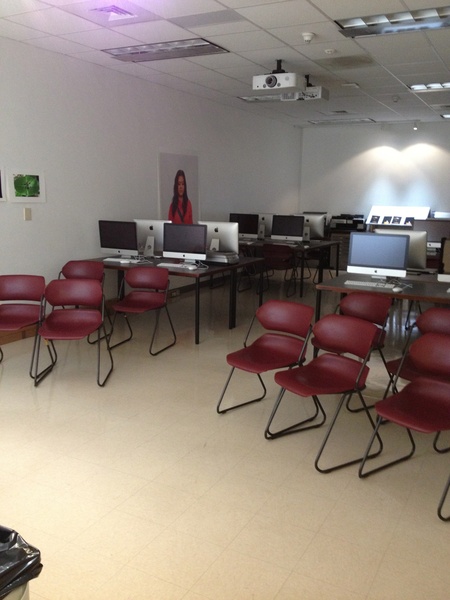
At what (x,y) coordinates should I click in order to perform the action: click on mouse. Please return your answer as a coordinate pair (x, y). Looking at the image, I should click on (396, 286).